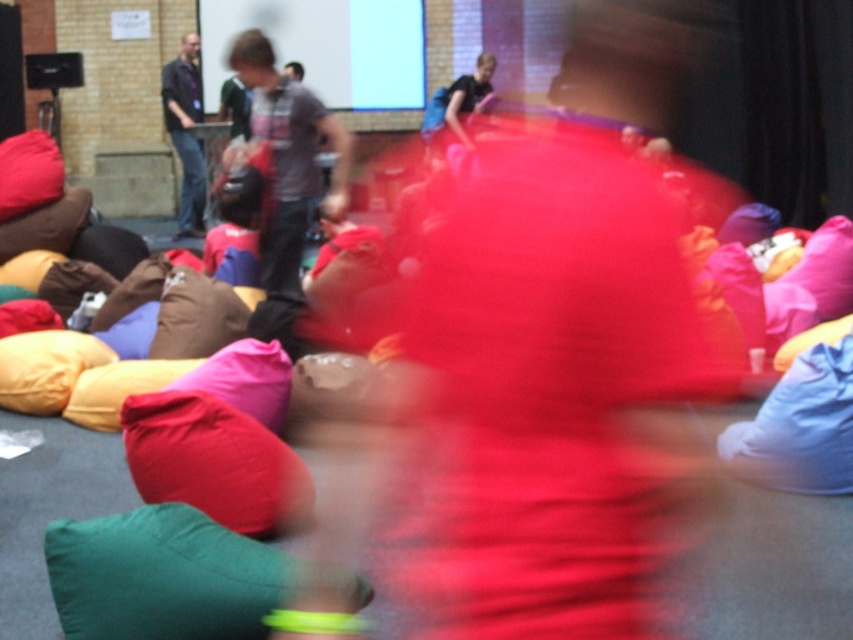
Question: Is velvet red cushion at lower left below white glossy projection screen at upper center?

Choices:
 (A) no
 (B) yes

Answer: (B)

Question: Which object is closer to the camera taking this photo?

Choices:
 (A) velvet red cushion at lower left
 (B) white glossy projection screen at upper center
 (C) matte purple shirt at center
 (D) brown fabric pillow at center

Answer: (A)

Question: Can you confirm if velvet red cushion at lower left is positioned above matte purple shirt at center?

Choices:
 (A) yes
 (B) no

Answer: (B)

Question: Among these points, which one is nearest to the camera?

Choices:
 (A) (213, 285)
 (B) (299, 60)

Answer: (A)

Question: Which object is farther from the camera taking this photo?

Choices:
 (A) brown fabric pillow at center
 (B) green fabric pillow at lower left
 (C) white glossy projection screen at upper center

Answer: (C)

Question: Does matte purple shirt at center appear over dark blue jeans at left?

Choices:
 (A) yes
 (B) no

Answer: (B)